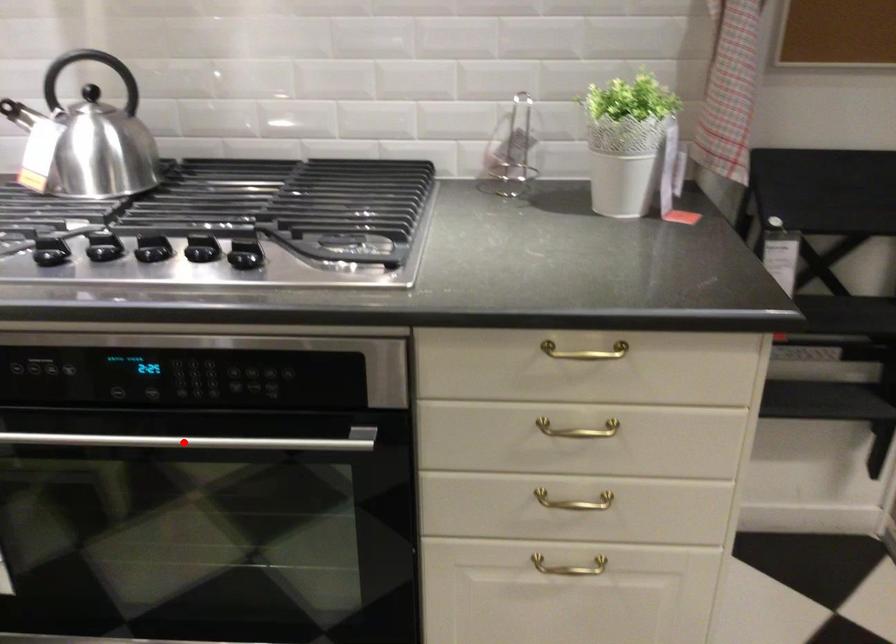
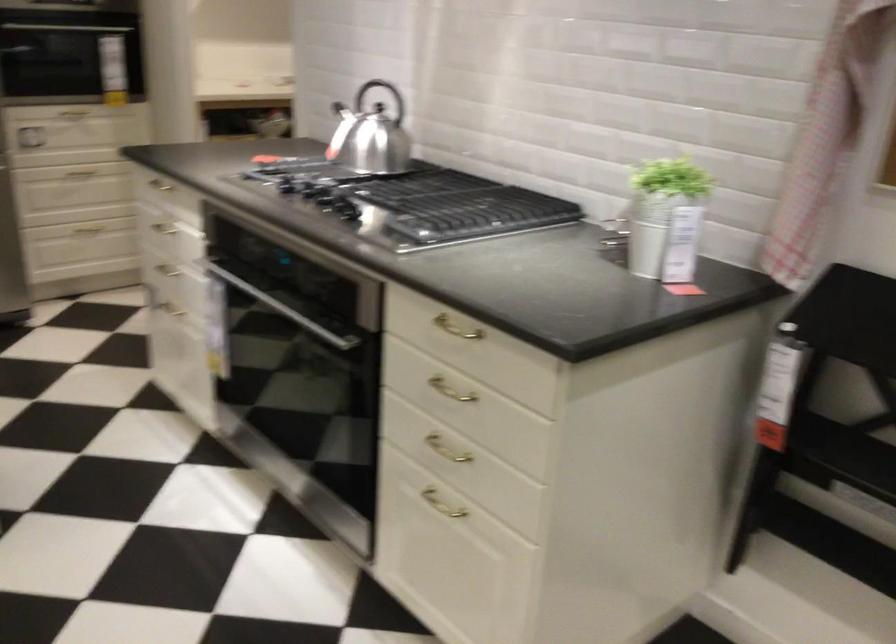
Question: I am providing you with two images of the same scene from different viewpoints. A red point is shown in image1. For the corresponding object point in image2, is it positioned nearer or farther from the camera?

Choices:
 (A) Nearer
 (B) Farther

Answer: (B)